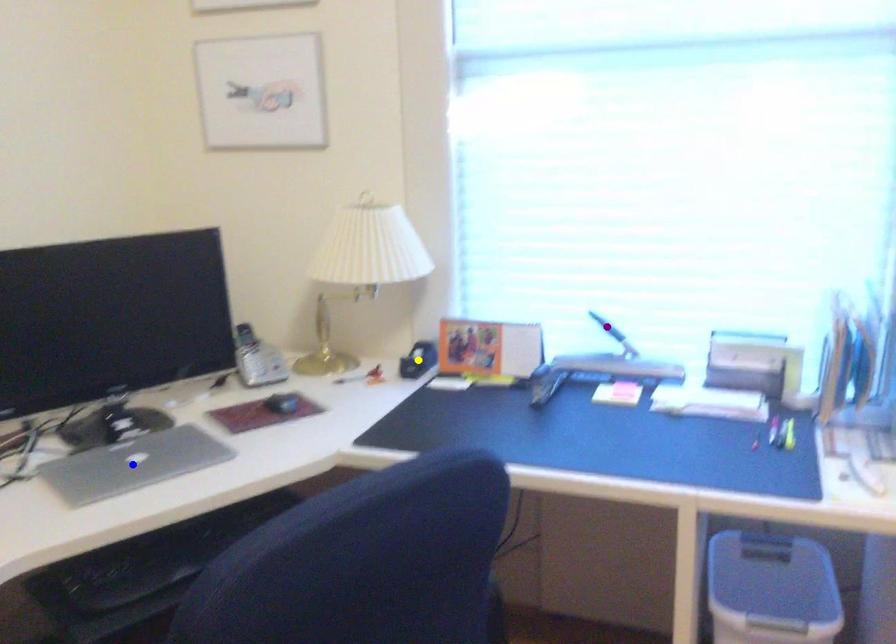
Order these from nearest to farthest:
blue point | yellow point | purple point

blue point → purple point → yellow point